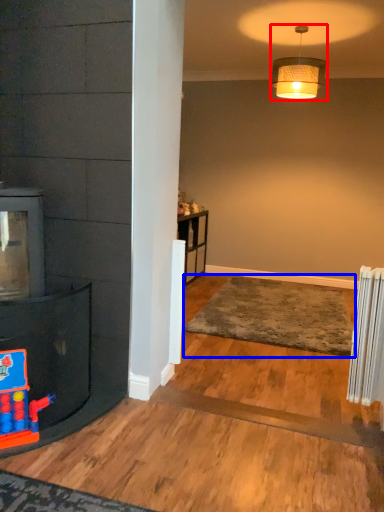
Question: Which of the following is the farthest to the observer, lamp (highlighted by a red box) or plain (highlighted by a blue box)?

Choices:
 (A) lamp
 (B) plain

Answer: (A)